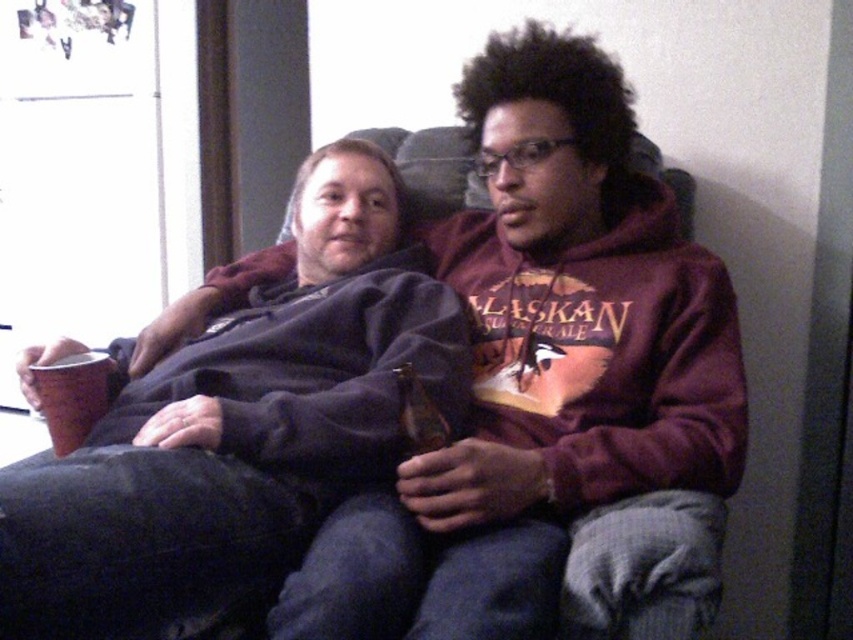
From the picture: Does matte black hoodie at center have a lesser width compared to translucent glass beer bottle at center?

Incorrect, matte black hoodie at center's width is not less than translucent glass beer bottle at center's.

Who is positioned more to the left, matte black hoodie at center or translucent glass beer bottle at center?

translucent glass beer bottle at center

Is point (224, 288) farther from viewer compared to point (426, 449)?

That is True.

You are a GUI agent. You are given a task and a screenshot of the screen. Output one action in this format:
    pyautogui.click(x=<x>, y=<y>)
    Task: Click on the matte black hoodie at center
    This screenshot has height=640, width=853.
    Given the screenshot: What is the action you would take?
    pyautogui.click(x=554, y=394)

Between matte black hoodie at center and matte black mug at left, which one appears on the right side from the viewer's perspective?

matte black hoodie at center is more to the right.

From the picture: Is matte black hoodie at center thinner than matte black mug at left?

Correct, matte black hoodie at center's width is less than matte black mug at left's.

The height and width of the screenshot is (640, 853). Find the location of `matte black hoodie at center`. matte black hoodie at center is located at coordinates (554, 394).

Can you confirm if matte black mug at left is shorter than translucent glass beer bottle at center?

Incorrect, matte black mug at left's height does not fall short of translucent glass beer bottle at center's.

Does matte black mug at left appear on the left side of translucent glass beer bottle at center?

Indeed, matte black mug at left is positioned on the left side of translucent glass beer bottle at center.

What do you see at coordinates (241, 422) in the screenshot? I see `matte black mug at left` at bounding box center [241, 422].

You are a GUI agent. You are given a task and a screenshot of the screen. Output one action in this format:
    pyautogui.click(x=<x>, y=<y>)
    Task: Click on the matte black mug at left
    This screenshot has width=853, height=640.
    Given the screenshot: What is the action you would take?
    pyautogui.click(x=241, y=422)